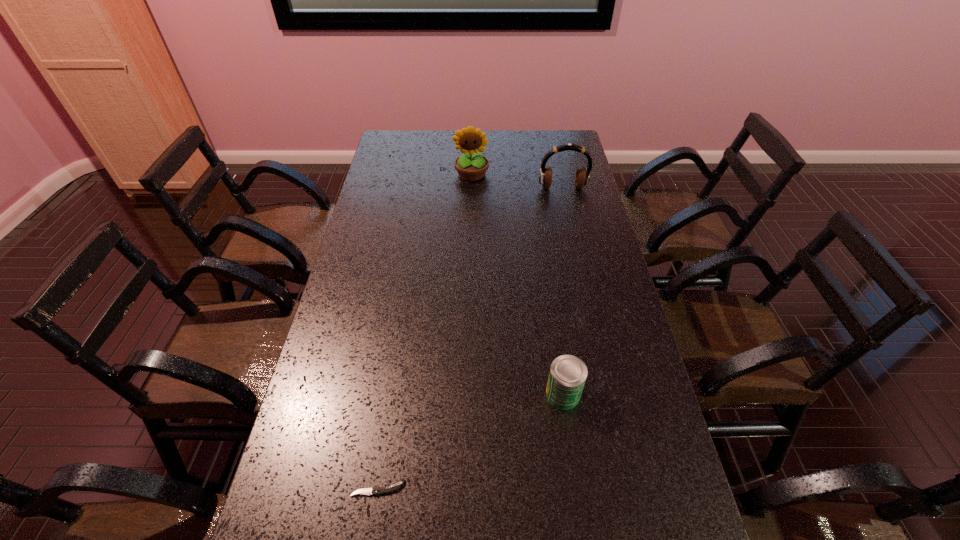
The image size is (960, 540). I want to click on object present at the left edge, so click(x=375, y=490).

At what (x,y) coordinates should I click in order to perform the action: click on object present at the right edge. Please return your answer as a coordinate pair (x, y). The height and width of the screenshot is (540, 960). Looking at the image, I should click on (582, 177).

Where is `vacant space at the far edge`? This screenshot has height=540, width=960. vacant space at the far edge is located at coordinates (454, 148).

Identify the location of vacant space at the left edge of the desktop. Image resolution: width=960 pixels, height=540 pixels. (315, 535).

I want to click on vacant area at the right edge of the desktop, so click(588, 358).

Image resolution: width=960 pixels, height=540 pixels. In order to click on vacant space at the far left corner of the desktop in this screenshot , I will do `click(416, 150)`.

The image size is (960, 540). What are the coordinates of `free space at the far right corner of the desktop` in the screenshot? It's located at (540, 141).

The width and height of the screenshot is (960, 540). What are the coordinates of `vacant area that lies between the third object from right to left and the can` in the screenshot? It's located at (517, 284).

Find the location of a particular element. Image resolution: width=960 pixels, height=540 pixels. free spot between the sunflower and the headset is located at coordinates (517, 181).

Where is `free point between the second nearest object and the sunflower`? free point between the second nearest object and the sunflower is located at coordinates tap(517, 284).